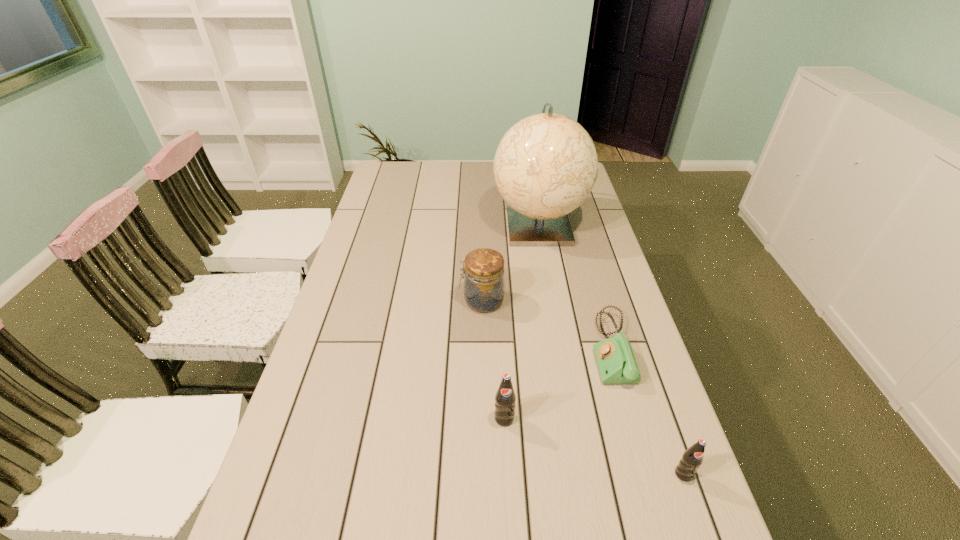
You are a GUI agent. You are given a task and a screenshot of the screen. Output one action in this format:
    pyautogui.click(x=<x>, y=<y>)
    Task: Click on the vacant space located on the lid of the jar
    The height and width of the screenshot is (540, 960).
    Given the screenshot: What is the action you would take?
    [x=371, y=301]

Where is `free region located 0.190m on the lid of the jar`? This screenshot has height=540, width=960. free region located 0.190m on the lid of the jar is located at coordinates (396, 301).

At what (x,y) coordinates should I click in order to perform the action: click on free space located on the lid of the jar. Please return your answer as a coordinate pair (x, y). The height and width of the screenshot is (540, 960). Looking at the image, I should click on (437, 301).

Identify the location of free space located on the dial of the telephone. The width and height of the screenshot is (960, 540). (529, 348).

The height and width of the screenshot is (540, 960). Identify the location of blank space located on the dial of the telephone. (537, 348).

Where is `free space located on the dial of the telephone`? free space located on the dial of the telephone is located at coordinates coord(540,348).

Locate an element on the screen. pop present at the right edge is located at coordinates (692, 458).

Where is `globe that is at the right edge`? Image resolution: width=960 pixels, height=540 pixels. globe that is at the right edge is located at coordinates (546, 165).

Identify the location of telephone that is positioned at the right edge. (616, 361).

In the image, there is a desktop. At what (x,y) coordinates should I click in order to perform the action: click on vacant space at the far edge. Please return your answer as a coordinate pair (x, y). The width and height of the screenshot is (960, 540). Looking at the image, I should click on (426, 177).